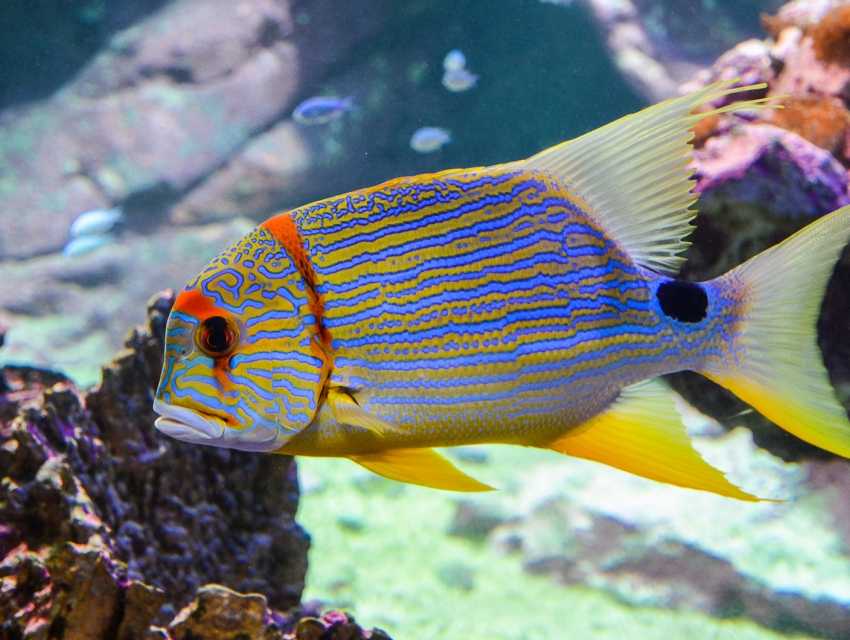
Where is `decorative rocks`? The image size is (850, 640). decorative rocks is located at coordinates (156, 525), (814, 91).